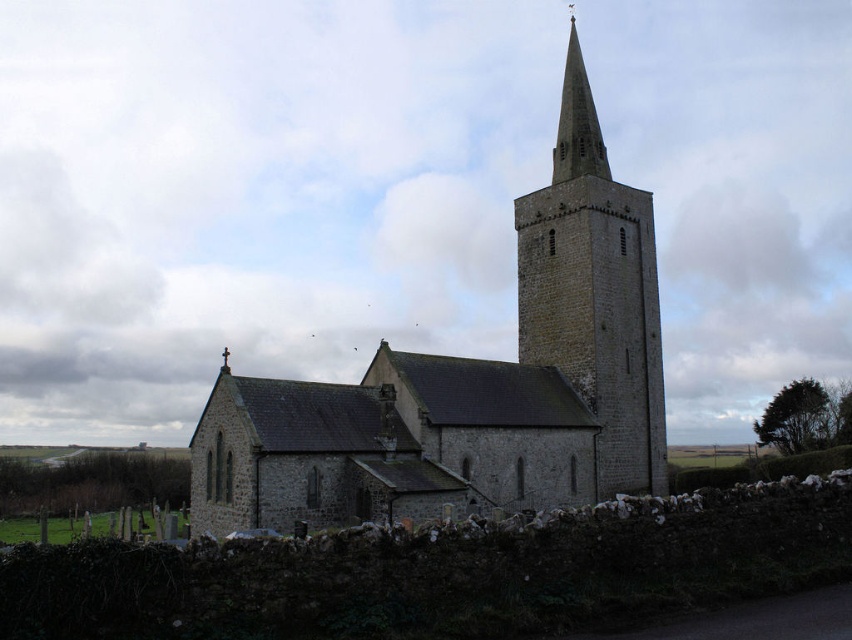
You are standing in front of the church and want to take a photo of both the stone steeple at center and the smooth stone spire at upper center. Which one is located lower in the image?

The stone steeple at center is positioned under the smooth stone spire at upper center, so the stone steeple at center is lower in the image.

You are standing in front of the stone church at center and want to take a photo of the smooth stone spire at upper center. Which direction should you face to ensure the spire is in the frame?

The stone church at center is in front of the smooth stone spire at upper center, so you should face towards the back of the stone church at center to capture the spire in your photo.

You are an architect designing a new garden layout around the stone church at center and the smooth stone spire at upper center. Considering their widths, which structure should you place closer to the entrance to ensure it is more noticeable?

The stone church at center is wider than the smooth stone spire at upper center. Therefore, placing the stone church at center closer to the entrance will make it more noticeable due to its greater width.